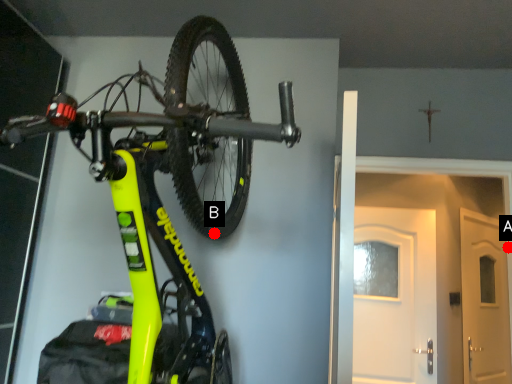
Question: Two points are circled on the image, labeled by A and B beside each circle. Among these points, which one is nearest to the camera?

Choices:
 (A) A is closer
 (B) B is closer

Answer: (B)